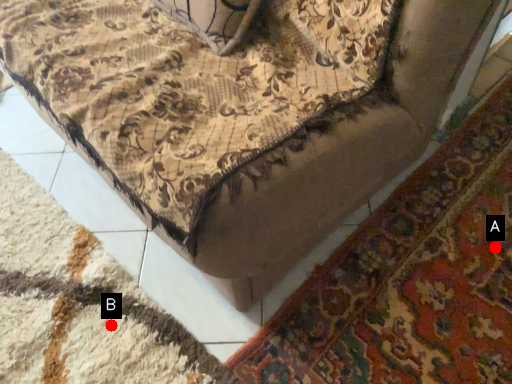
Question: Two points are circled on the image, labeled by A and B beside each circle. Which of the following is the closest to the observer?

Choices:
 (A) A is closer
 (B) B is closer

Answer: (B)